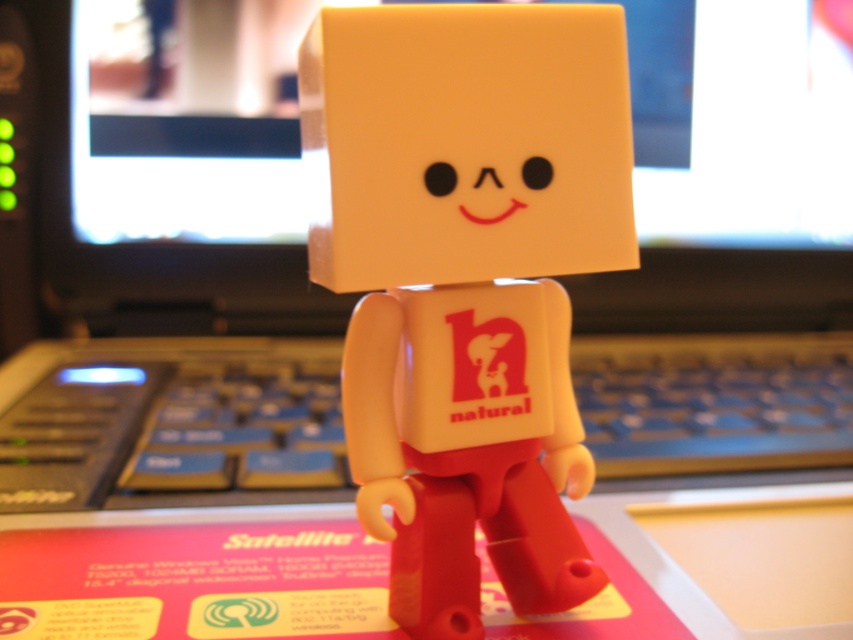
You are a delivery robot trying to navigate around the figurine. You need to move from the point at coordinates point (187, 148) to the point at coordinates point (590, 385). Which direction should you move relative to the figurine?

Since point (187, 148) is behind the figurine, you should move forward towards point (590, 385) to navigate around it.

Consider the image. You are setting up your desk and need to place the matte plastic figurine at center and the blue plastic keyboard at center. According to the image, which object is on the left side?

The blue plastic keyboard at center is on the left side because the matte plastic figurine at center is positioned on the right side of it.